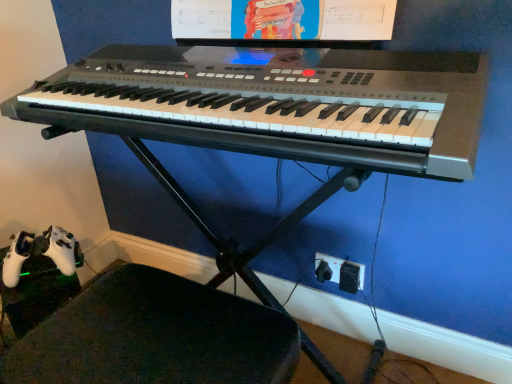
Question: In terms of height, does black plastic keyboard at center look taller or shorter compared to black plastic plug at lower right?

Choices:
 (A) tall
 (B) short

Answer: (B)

Question: In the image, is black plastic keyboard at center positioned in front of or behind black plastic plug at lower right?

Choices:
 (A) front
 (B) behind

Answer: (A)

Question: Based on their relative distances, which object is nearer to the matte plastic computer monitor at upper center?

Choices:
 (A) black leather swivel chair at lower left
 (B) black plastic plug at lower right
 (C) black plastic keyboard at center

Answer: (C)

Question: Which of these objects is positioned closest to the black leather swivel chair at lower left?

Choices:
 (A) black plastic plug at lower right
 (B) black plastic keyboard at center
 (C) matte plastic computer monitor at upper center

Answer: (B)